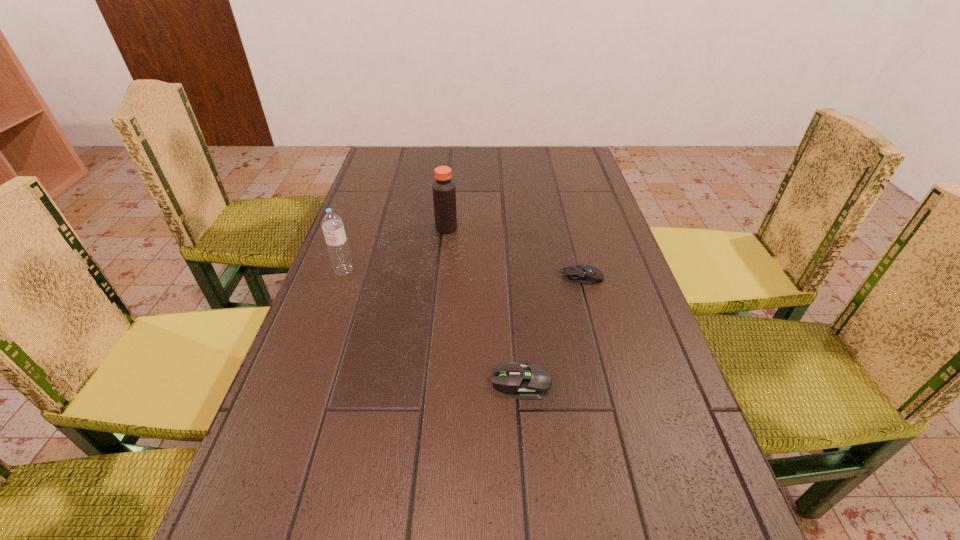
At what (x,y) coordinates should I click in order to perform the action: click on the second object from left to right. Please return your answer as a coordinate pair (x, y). The width and height of the screenshot is (960, 540). Looking at the image, I should click on (444, 192).

The width and height of the screenshot is (960, 540). I want to click on vinegar, so click(x=444, y=192).

This screenshot has height=540, width=960. I want to click on the leftmost object, so click(x=332, y=224).

I want to click on the right computer mouse, so click(582, 273).

Image resolution: width=960 pixels, height=540 pixels. I want to click on the farther computer mouse, so click(x=582, y=273).

Find the location of `the nearer computer mouse`. the nearer computer mouse is located at coordinates (530, 381).

Identify the location of the nearest object. (530, 381).

The height and width of the screenshot is (540, 960). In order to click on blank space located on the back of the farthest object in this screenshot , I will do `click(451, 178)`.

Where is `vacant space positioned on the right of the leftmost object`? The image size is (960, 540). vacant space positioned on the right of the leftmost object is located at coordinates (x=419, y=271).

Find the location of a particular element. vacant space located 0.320m on the back of the rightmost object is located at coordinates (561, 202).